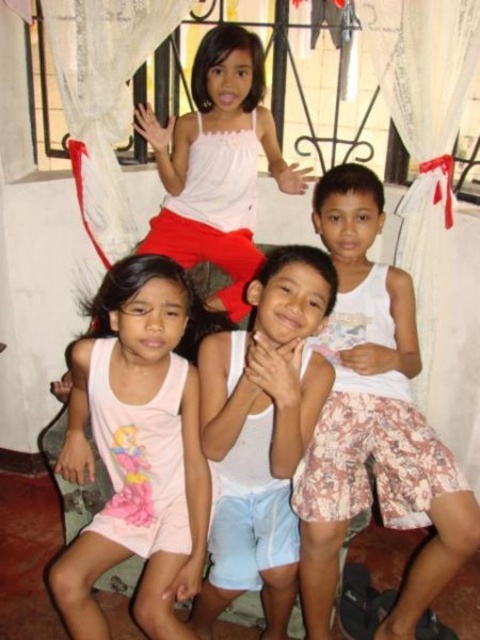
You are a photographer trying to capture a closeup of the pink cotton dress at lower left and the white matte tank top at upper center. Which item should you focus on first to ensure it appears sharp in the photo?

A: The pink cotton dress at lower left should be focused on first because it is closer to the viewer than the white matte tank top at upper center, so focusing on it will ensure it appears sharp while the other may be slightly blurred.

You are a photographer trying to capture a group shot of the children. You notice the white cotton tank top at center and the pink cotton dress at lower left. Which child should you adjust to the left to ensure they are centered in the frame?

The white cotton tank top at center is positioned on the right side of the pink cotton dress at lower left. To center them, move the pink cotton dress at lower left to the right or the white cotton tank top at center to the left.

You are organizing a school photo session and need to arrange the children so that the white cotton shirt at center and the white matte tank top at upper center are visible. Based on their positions, which clothing item is positioned higher in the image?

The white cotton shirt at center is taller than the white matte tank top at upper center, so the white cotton shirt at center is positioned higher in the image.